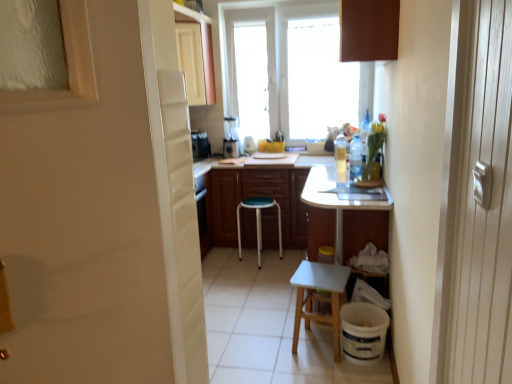
Question: Is white wood stool at lower center, placed as the 1th stool when sorted from front to back, with white glossy screen door at left?

Choices:
 (A) yes
 (B) no

Answer: (B)

Question: Could white glossy screen door at left be considered to be inside white wood stool at lower center, marked as the 2th stool in a left-to-right arrangement?

Choices:
 (A) no
 (B) yes

Answer: (A)

Question: Can you confirm if white wood stool at lower center, which is counted as the 1th stool, starting from the right, is shorter than white glossy screen door at left?

Choices:
 (A) no
 (B) yes

Answer: (B)

Question: Considering the relative sizes of white wood stool at lower center, the 2th stool when ordered from back to front, and white glossy screen door at left in the image provided, is white wood stool at lower center, the 2th stool when ordered from back to front, wider than white glossy screen door at left?

Choices:
 (A) no
 (B) yes

Answer: (B)

Question: Does white wood stool at lower center, the 2th stool when ordered from back to front, appear on the left side of white glossy screen door at left?

Choices:
 (A) yes
 (B) no

Answer: (B)

Question: Considering the relative sizes of white wood stool at lower center, placed as the 1th stool when sorted from front to back, and white glossy screen door at left in the image provided, is white wood stool at lower center, placed as the 1th stool when sorted from front to back, smaller than white glossy screen door at left?

Choices:
 (A) no
 (B) yes

Answer: (A)

Question: Can you confirm if green plastic stool at center, the 2th stool in the right-to-left sequence, is smaller than clear plastic bottle at right, the 2th bottle from the right?

Choices:
 (A) no
 (B) yes

Answer: (A)

Question: Could you tell me if green plastic stool at center, placed as the first stool when sorted from left to right, is turned towards clear plastic bottle at right, the second bottle positioned from the left?

Choices:
 (A) no
 (B) yes

Answer: (A)

Question: Is the position of green plastic stool at center, placed as the first stool when sorted from back to front, less distant than that of clear plastic bottle at right, the second bottle positioned from the left?

Choices:
 (A) yes
 (B) no

Answer: (B)

Question: From a real-world perspective, does green plastic stool at center, placed as the first stool when sorted from back to front, sit lower than clear plastic bottle at right, arranged as the 1th bottle when viewed from the front?

Choices:
 (A) yes
 (B) no

Answer: (A)

Question: Is green plastic stool at center, the 2th stool from the front, completely or partially outside of clear plastic bottle at right, the 2th bottle from the right?

Choices:
 (A) no
 (B) yes

Answer: (B)

Question: Is green plastic stool at center, the 2th stool from the front, thinner than clear plastic bottle at right, the second bottle positioned from the left?

Choices:
 (A) yes
 (B) no

Answer: (B)

Question: Would you say metallic silver blender at center is outside green plastic stool at center, placed as the first stool when sorted from left to right?

Choices:
 (A) no
 (B) yes

Answer: (B)